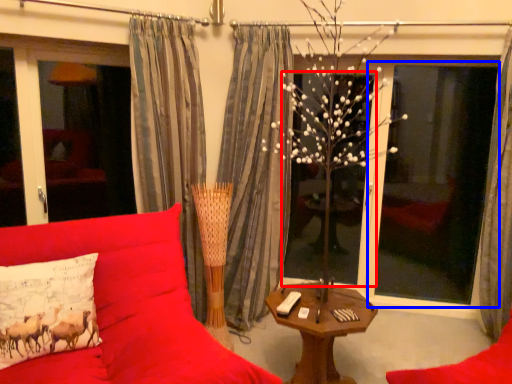
Question: Which of the following is the closest to the observer, window (highlighted by a red box) or window screen (highlighted by a blue box)?

Choices:
 (A) window
 (B) window screen

Answer: (B)